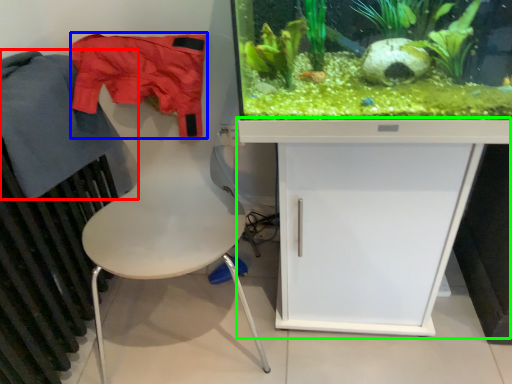
Question: Which object is the farthest from clothing (highlighted by a red box)? Choose among these: clothing (highlighted by a blue box) or computer desk (highlighted by a green box).

Choices:
 (A) clothing
 (B) computer desk

Answer: (B)